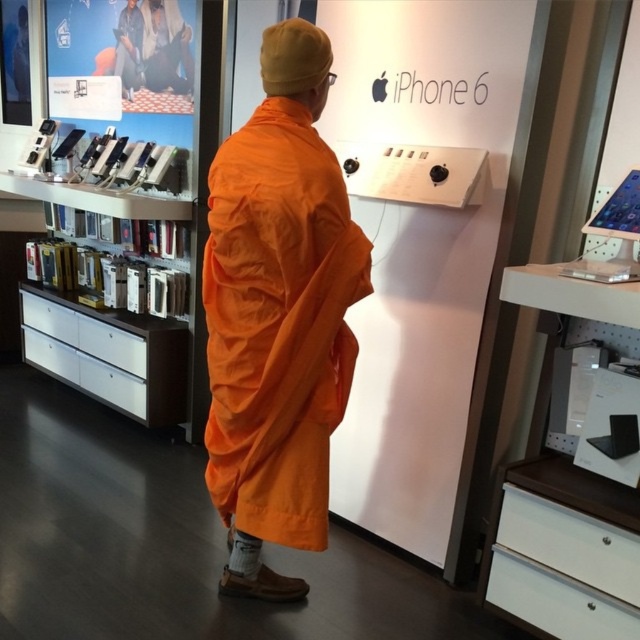
Question: Based on their relative distances, which object is farther from the orange fabric at center?

Choices:
 (A) white matte bookshelf at lower right
 (B) white glossy bookshelf at left

Answer: (B)

Question: Based on their relative distances, which object is farther from the white matte bookshelf at lower right?

Choices:
 (A) white glossy bookshelf at left
 (B) orange fabric at center

Answer: (A)

Question: Is orange fabric at center further to camera compared to white matte bookshelf at lower right?

Choices:
 (A) no
 (B) yes

Answer: (B)

Question: Considering the real-world distances, which object is closest to the orange fabric at center?

Choices:
 (A) white matte bookshelf at lower right
 (B) white glossy bookshelf at left

Answer: (A)

Question: Does orange fabric at center have a greater width compared to white glossy bookshelf at left?

Choices:
 (A) no
 (B) yes

Answer: (A)

Question: Is the position of white matte bookshelf at lower right less distant than that of white glossy bookshelf at left?

Choices:
 (A) yes
 (B) no

Answer: (A)